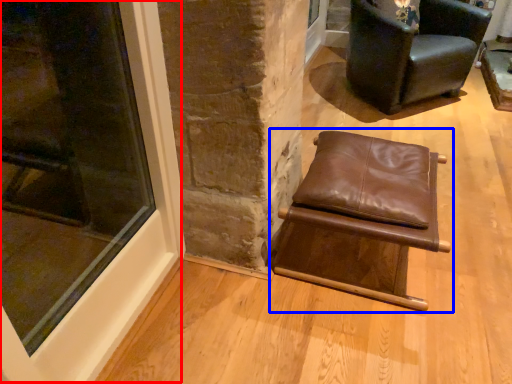
Question: Which object appears closest to the camera in this image, window (highlighted by a red box) or chair (highlighted by a blue box)?

Choices:
 (A) window
 (B) chair

Answer: (A)